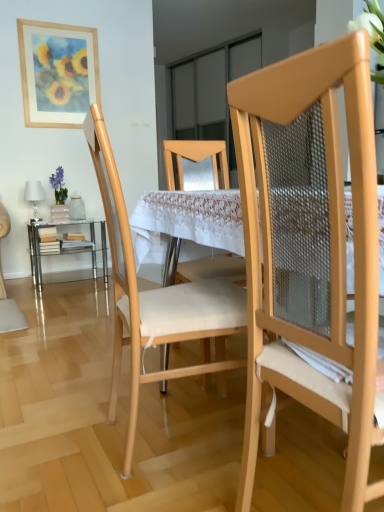
Question: Is clear glass table at lower left, the 2th table positioned from the right, thinner than natural wood chair at center, placed as the 1th chair when sorted from back to front?

Choices:
 (A) no
 (B) yes

Answer: (B)

Question: Is clear glass table at lower left, acting as the second table starting from the front, turned away from natural wood chair at center, placed as the 1th chair when sorted from back to front?

Choices:
 (A) yes
 (B) no

Answer: (B)

Question: Would you say clear glass table at lower left, acting as the 1th table starting from the left, is a long distance from natural wood chair at center, marked as the second chair in a front-to-back arrangement?

Choices:
 (A) yes
 (B) no

Answer: (A)

Question: Considering the relative sizes of clear glass table at lower left, which is the 1th table from back to front, and natural wood chair at center, marked as the second chair in a front-to-back arrangement, in the image provided, is clear glass table at lower left, which is the 1th table from back to front, shorter than natural wood chair at center, marked as the second chair in a front-to-back arrangement,?

Choices:
 (A) yes
 (B) no

Answer: (A)

Question: Can you confirm if clear glass table at lower left, which is the 1th table from back to front, is positioned to the left of natural wood chair at center, placed as the 1th chair when sorted from back to front?

Choices:
 (A) no
 (B) yes

Answer: (B)

Question: Is point (102, 249) positioned closer to the camera than point (339, 72)?

Choices:
 (A) farther
 (B) closer

Answer: (A)

Question: In terms of width, does clear glass table at lower left, acting as the second table starting from the front, look wider or thinner when compared to matte wood chair at right, the second chair when ordered from back to front?

Choices:
 (A) wide
 (B) thin

Answer: (A)

Question: Based on their sizes in the image, would you say clear glass table at lower left, which is the 1th table from back to front, is bigger or smaller than matte wood chair at right, the second chair when ordered from back to front?

Choices:
 (A) big
 (B) small

Answer: (B)

Question: Would you say clear glass table at lower left, acting as the second table starting from the front, is to the left or to the right of matte wood chair at right, the second chair when ordered from back to front, in the picture?

Choices:
 (A) left
 (B) right

Answer: (A)

Question: From the image's perspective, is clear glass table at lower left, acting as the second table starting from the front, located above or below white lace tablecloth at center, which is counted as the first table, starting from the right?

Choices:
 (A) above
 (B) below

Answer: (A)

Question: Is clear glass table at lower left, acting as the second table starting from the front, taller or shorter than white lace tablecloth at center, the second table when ordered from left to right?

Choices:
 (A) tall
 (B) short

Answer: (B)

Question: Looking at their shapes, would you say clear glass table at lower left, acting as the second table starting from the front, is wider or thinner than white lace tablecloth at center, which is the 1th table in front-to-back order?

Choices:
 (A) thin
 (B) wide

Answer: (A)

Question: Visually, is clear glass table at lower left, which is the 1th table from back to front, positioned to the left or to the right of white lace tablecloth at center, the second table when ordered from back to front?

Choices:
 (A) left
 (B) right

Answer: (A)

Question: Is clear glass table at lower left, the 2th table positioned from the right, inside the boundaries of natural wood chair at center, marked as the second chair in a front-to-back arrangement, or outside?

Choices:
 (A) inside
 (B) outside

Answer: (B)

Question: Visually, is clear glass table at lower left, the 2th table positioned from the right, positioned to the left or to the right of natural wood chair at center, placed as the 1th chair when sorted from back to front?

Choices:
 (A) left
 (B) right

Answer: (A)